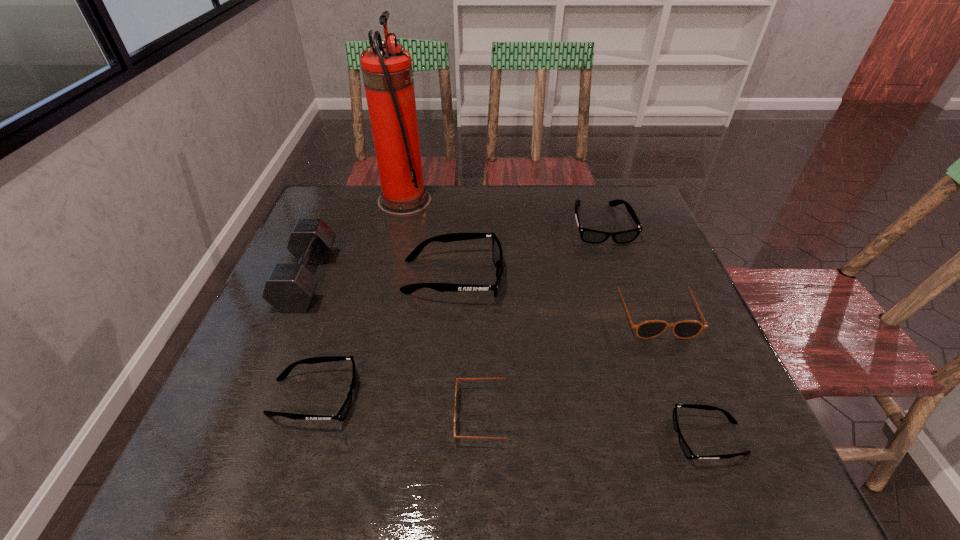
Identify the location of object that is at the far right corner. The width and height of the screenshot is (960, 540). (587, 235).

The width and height of the screenshot is (960, 540). In order to click on object positioned at the near right corner in this screenshot , I will do `click(689, 454)`.

In the image, there is a desktop. What are the coordinates of `vacant region at the far edge` in the screenshot? It's located at (516, 213).

The width and height of the screenshot is (960, 540). In order to click on vacant area at the near edge of the desktop in this screenshot , I will do `click(450, 449)`.

Find the location of a particular element. free space at the left edge of the desktop is located at coordinates (278, 386).

Locate an element on the screen. This screenshot has width=960, height=540. vacant space at the right edge of the desktop is located at coordinates (659, 285).

Find the location of `free point at the far left corner`. free point at the far left corner is located at coordinates point(362,202).

The width and height of the screenshot is (960, 540). I want to click on vacant space at the near left corner of the desktop, so point(270,450).

Find the location of a particular element. Image resolution: width=960 pixels, height=540 pixels. vacant space at the far right corner of the desktop is located at coordinates (620, 206).

The width and height of the screenshot is (960, 540). Find the location of `free space that is in between the second farthest black sunglasses and the smallest black sunglasses`. free space that is in between the second farthest black sunglasses and the smallest black sunglasses is located at coordinates (581, 357).